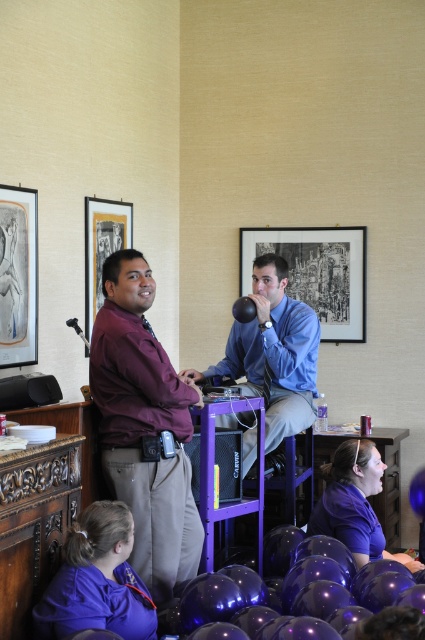
You are organizing a party and need to ensure the balloons are spaced out for safety. The safety guideline states that balloons must be at least 2 meters apart. Are the glossy purple balloon at lower center and glossy black balloon at center meeting this requirement?

The distance between the glossy purple balloon at lower center and the glossy black balloon at center is 2.37 meters, which exceeds the minimum requirement of 2 meters. Therefore, they meet the safety guideline.